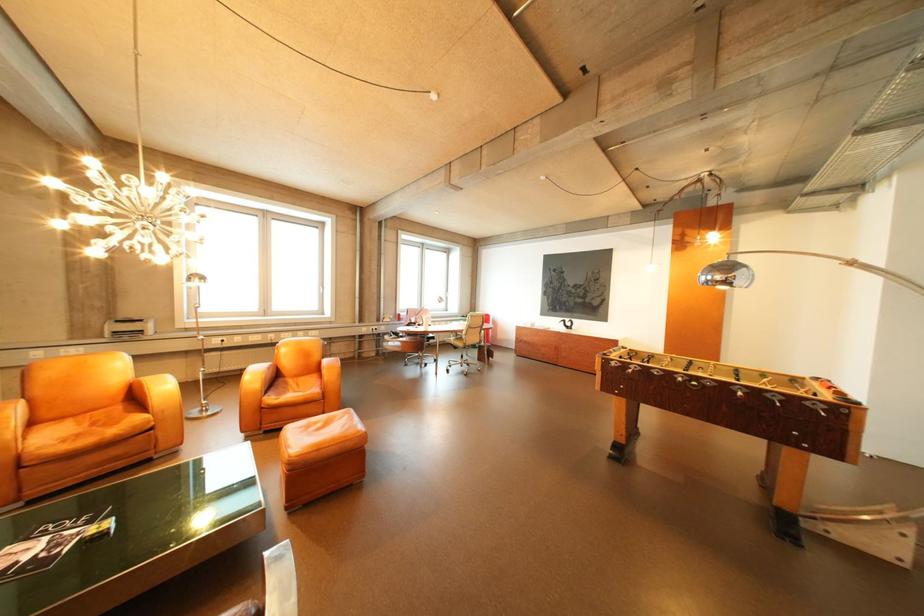
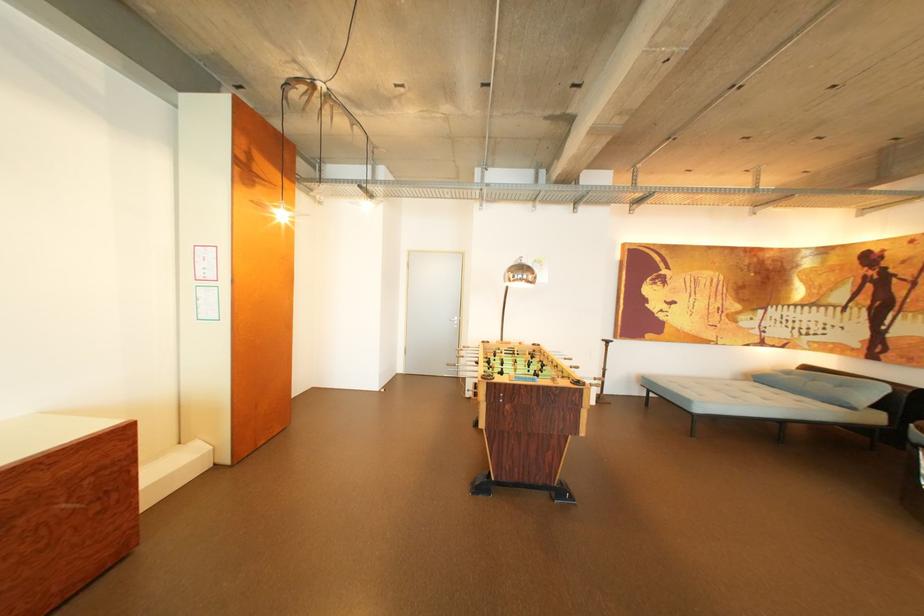
In the second image, find the point that corresponds to point 769,392 in the first image.

(562, 357)